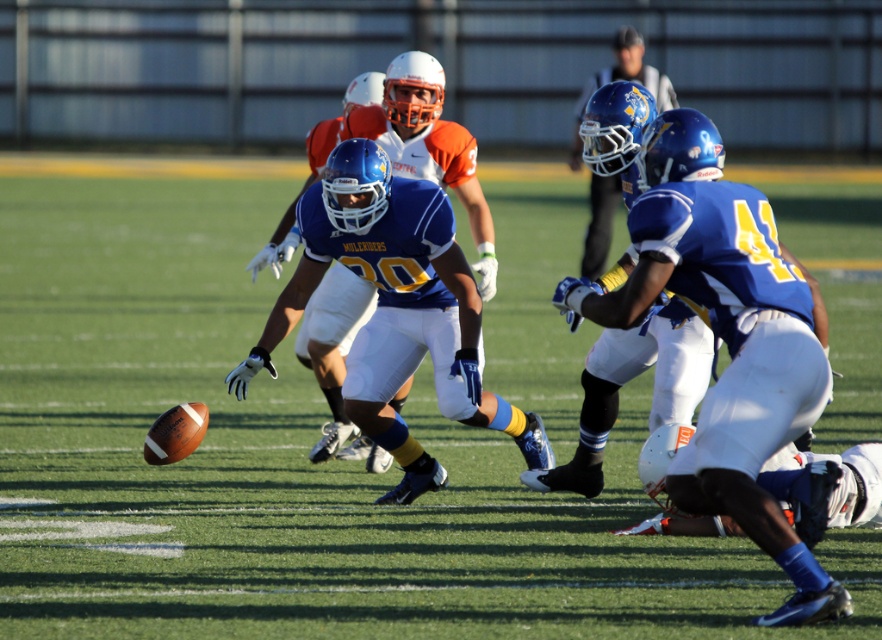
Can you confirm if matte blue jersey at center is thinner than blue matte helmet at upper center?

Correct, matte blue jersey at center's width is less than blue matte helmet at upper center's.

Does matte blue jersey at center have a larger size compared to blue matte helmet at upper center?

No.

Where is `matte blue jersey at center`? The height and width of the screenshot is (640, 882). matte blue jersey at center is located at coordinates (729, 340).

I want to click on matte blue jersey at center, so click(729, 340).

Does blue matte uniform at center appear on the left side of blue matte helmet at upper center?

Correct, you'll find blue matte uniform at center to the left of blue matte helmet at upper center.

Which of these two, blue matte uniform at center or blue matte helmet at upper center, stands shorter?

With less height is blue matte uniform at center.

Locate an element on the screen. The image size is (882, 640). blue matte uniform at center is located at coordinates (404, 152).

Identify the location of blue matte uniform at center. The width and height of the screenshot is (882, 640). (404, 152).

Which is in front, point (675, 227) or point (326, 276)?

Point (675, 227)

Which is below, matte blue jersey at center or blue matte uniform at center?

Positioned lower is matte blue jersey at center.

Does point (729, 476) come closer to viewer compared to point (338, 456)?

Yes, point (729, 476) is closer to viewer.

This screenshot has width=882, height=640. I want to click on matte blue jersey at center, so click(729, 340).